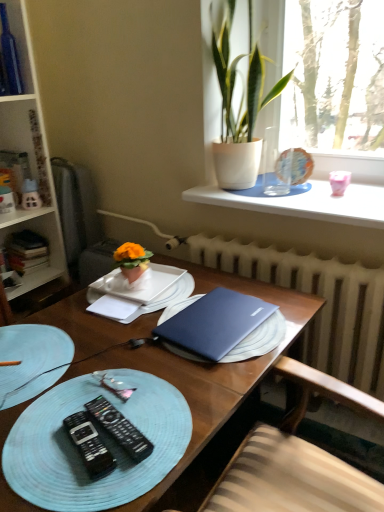
Where is `vacant space that's between black plastic remote control at lower left, which ranks as the second remote control in left-to-right order, and blue woven placemat at lower left, arranged as the first tableware when ordered from the bottom`? vacant space that's between black plastic remote control at lower left, which ranks as the second remote control in left-to-right order, and blue woven placemat at lower left, arranged as the first tableware when ordered from the bottom is located at coordinates (74, 408).